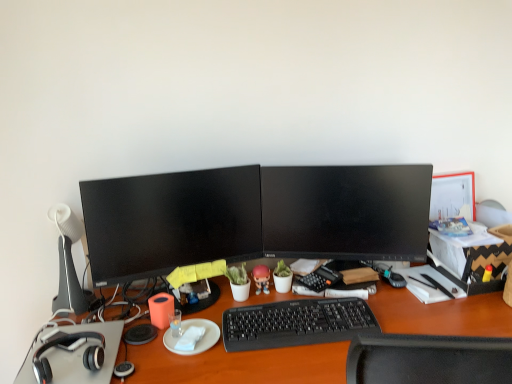
Find the location of a particular element. Image resolution: width=512 pixels, height=384 pixels. black glossy monitor at center, arranged as the 1th computer monitor when viewed from the right is located at coordinates (346, 212).

The width and height of the screenshot is (512, 384). I want to click on pink matte figurine at center, so click(261, 278).

The height and width of the screenshot is (384, 512). Describe the element at coordinates (170, 221) in the screenshot. I see `matte black monitor at center, acting as the second computer monitor starting from the right` at that location.

Locate an element on the screen. The height and width of the screenshot is (384, 512). matte black monitor at center, acting as the second computer monitor starting from the right is located at coordinates (170, 221).

Identify the location of white plastic table lamp at left. (68, 263).

This screenshot has height=384, width=512. What do you see at coordinates (68, 263) in the screenshot?
I see `white plastic table lamp at left` at bounding box center [68, 263].

Locate an element on the screen. This screenshot has width=512, height=384. black glossy monitor at center, the 2th computer monitor in the left-to-right sequence is located at coordinates (346, 212).

Consider the image. Is wooden desk at center smaller than black glossy monitor at center, arranged as the 1th computer monitor when viewed from the right?

Incorrect, wooden desk at center is not smaller in size than black glossy monitor at center, arranged as the 1th computer monitor when viewed from the right.

Is wooden desk at center at the right side of black glossy monitor at center, the 2th computer monitor in the left-to-right sequence?

No.

Is wooden desk at center not close to black glossy monitor at center, arranged as the 1th computer monitor when viewed from the right?

No, wooden desk at center is not far away from black glossy monitor at center, arranged as the 1th computer monitor when viewed from the right.

In terms of height, does black glossy monitor at center, the 2th computer monitor in the left-to-right sequence, look taller or shorter compared to wooden desk at center?

In the image, black glossy monitor at center, the 2th computer monitor in the left-to-right sequence, appears to be shorter than wooden desk at center.

In the image, is black glossy monitor at center, the 2th computer monitor in the left-to-right sequence, on the left side or the right side of wooden desk at center?

black glossy monitor at center, the 2th computer monitor in the left-to-right sequence, is positioned on wooden desk at center's right side.

Based on the photo, would you say black glossy monitor at center, arranged as the 1th computer monitor when viewed from the right, is inside or outside wooden desk at center?

black glossy monitor at center, arranged as the 1th computer monitor when viewed from the right, is not enclosed by wooden desk at center.

Is black glossy monitor at center, the 2th computer monitor in the left-to-right sequence, outside of black plastic keyboard at center?

Absolutely, black glossy monitor at center, the 2th computer monitor in the left-to-right sequence, is external to black plastic keyboard at center.

Is black glossy monitor at center, the 2th computer monitor in the left-to-right sequence, facing towards black plastic keyboard at center?

No, black glossy monitor at center, the 2th computer monitor in the left-to-right sequence, is not turned towards black plastic keyboard at center.

From the image's perspective, which one is positioned higher, black glossy monitor at center, arranged as the 1th computer monitor when viewed from the right, or black plastic keyboard at center?

black glossy monitor at center, arranged as the 1th computer monitor when viewed from the right.

Does black glossy monitor at center, the 2th computer monitor in the left-to-right sequence, have a lesser width compared to black plastic keyboard at center?

Correct, the width of black glossy monitor at center, the 2th computer monitor in the left-to-right sequence, is less than that of black plastic keyboard at center.

In the image, is matte black monitor at center, acting as the second computer monitor starting from the right, positioned in front of or behind black glossy monitor at center, the 2th computer monitor in the left-to-right sequence?

Visually, matte black monitor at center, acting as the second computer monitor starting from the right, is located in front of black glossy monitor at center, the 2th computer monitor in the left-to-right sequence.

Is matte black monitor at center, which is the first computer monitor in left-to-right order, completely or partially outside of black glossy monitor at center, the 2th computer monitor in the left-to-right sequence?

matte black monitor at center, which is the first computer monitor in left-to-right order, is positioned outside black glossy monitor at center, the 2th computer monitor in the left-to-right sequence.

From the picture: Could you tell me if matte black monitor at center, which is the first computer monitor in left-to-right order, is facing black glossy monitor at center, arranged as the 1th computer monitor when viewed from the right?

No, matte black monitor at center, which is the first computer monitor in left-to-right order, is not facing towards black glossy monitor at center, arranged as the 1th computer monitor when viewed from the right.

Does black plastic keyboard at center have a smaller size compared to wooden desk at center?

Yes, black plastic keyboard at center is smaller than wooden desk at center.

Which point is more distant from viewer, (240, 320) or (219, 321)?

Point (219, 321)

Find the location of `computer keyboard that is above the wooden desk at center (from a real-world perspective)`. computer keyboard that is above the wooden desk at center (from a real-world perspective) is located at coordinates (296, 323).

How far apart are matte black monitor at center, acting as the second computer monitor starting from the right, and pink matte figurine at center?

matte black monitor at center, acting as the second computer monitor starting from the right, is 12.77 inches away from pink matte figurine at center.

Locate an element on the screen. This screenshot has width=512, height=384. the 2nd computer monitor in front of the pink matte figurine at center, starting your count from the anchor is located at coordinates coord(170,221).

From a real-world perspective, is matte black monitor at center, which is the first computer monitor in left-to-right order, located higher than pink matte figurine at center?

Indeed, from a real-world perspective, matte black monitor at center, which is the first computer monitor in left-to-right order, stands above pink matte figurine at center.

Who is bigger, matte black monitor at center, acting as the second computer monitor starting from the right, or pink matte figurine at center?

matte black monitor at center, acting as the second computer monitor starting from the right, is bigger.

From a real-world perspective, between matte black monitor at center, which is the first computer monitor in left-to-right order, and white plastic table lamp at left, who is vertically higher?

matte black monitor at center, which is the first computer monitor in left-to-right order, is physically above.

Looking at this image, from the image's perspective, does matte black monitor at center, acting as the second computer monitor starting from the right, appear higher than white plastic table lamp at left?

Yes.

You are a GUI agent. You are given a task and a screenshot of the screen. Output one action in this format:
    pyautogui.click(x=<x>, y=<y>)
    Task: Click on the table lamp that is under the matte black monitor at center, acting as the second computer monitor starting from the right (from a real-world perspective)
    The width and height of the screenshot is (512, 384).
    Given the screenshot: What is the action you would take?
    (x=68, y=263)

Looking at this image, can you confirm if matte black monitor at center, which is the first computer monitor in left-to-right order, is shorter than white plastic table lamp at left?

Correct, matte black monitor at center, which is the first computer monitor in left-to-right order, is not as tall as white plastic table lamp at left.

From the image's perspective, count 2nd computer monitors upward from the wooden desk at center and point to it. Please provide its 2D coordinates.

[(346, 212)]

Identify the location of computer monitor on the right side of wooden desk at center. (346, 212).

In the scene shown: From the image, which object appears to be farther from wooden desk at center, white paper at center or matte black monitor at center, which is the first computer monitor in left-to-right order?

white paper at center lies further to wooden desk at center than the other object.

Looking at the image, which one is located closer to pink matte figurine at center, white paper at center or wooden desk at center?

white paper at center lies closer to pink matte figurine at center than the other object.

Considering their positions, is wooden desk at center positioned further to matte black monitor at center, acting as the second computer monitor starting from the right, than white paper at center?

The object further to matte black monitor at center, acting as the second computer monitor starting from the right, is white paper at center.

Looking at the image, which one is located further to wooden desk at center, black glossy monitor at center, the 2th computer monitor in the left-to-right sequence, or matte black monitor at center, which is the first computer monitor in left-to-right order?

matte black monitor at center, which is the first computer monitor in left-to-right order, is further to wooden desk at center.

When comparing their distances from white paper at center, does matte black monitor at center, acting as the second computer monitor starting from the right, or white plastic table lamp at left seem further?

Among the two, white plastic table lamp at left is located further to white paper at center.

Looking at the image, which one is located closer to white paper at center, black glossy monitor at center, arranged as the 1th computer monitor when viewed from the right, or white plastic table lamp at left?

Based on the image, white plastic table lamp at left appears to be nearer to white paper at center.

Consider the image. Considering their positions, is orange matte tissue at center positioned closer to wooden desk at center than white paper at center?

white paper at center.

Estimate the real-world distances between objects in this image. Which object is further from white paper at center, matte black monitor at center, acting as the second computer monitor starting from the right, or orange matte tissue at center?

Based on the image, matte black monitor at center, acting as the second computer monitor starting from the right, appears to be further to white paper at center.

Identify the location of desk located between orange matte tissue at center and black glossy monitor at center, the 2th computer monitor in the left-to-right sequence, in the left-right direction. (241, 365).

Where is `stationery between white plastic table lamp at left and wooden desk at center`? This screenshot has height=384, width=512. stationery between white plastic table lamp at left and wooden desk at center is located at coordinates (161, 309).

At what (x,y) coordinates should I click in order to perform the action: click on computer keyboard between wooden desk at center and pink matte figurine at center in the front-back direction. Please return your answer as a coordinate pair (x, y). Image resolution: width=512 pixels, height=384 pixels. Looking at the image, I should click on (296, 323).

At what (x,y) coordinates should I click in order to perform the action: click on computer monitor between orange matte tissue at center and black plastic keyboard at center in the horizontal direction. Please return your answer as a coordinate pair (x, y). The height and width of the screenshot is (384, 512). Looking at the image, I should click on (170, 221).